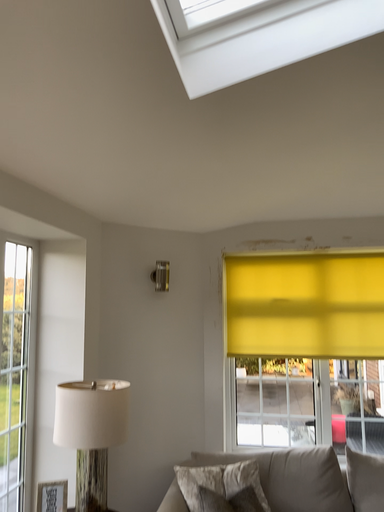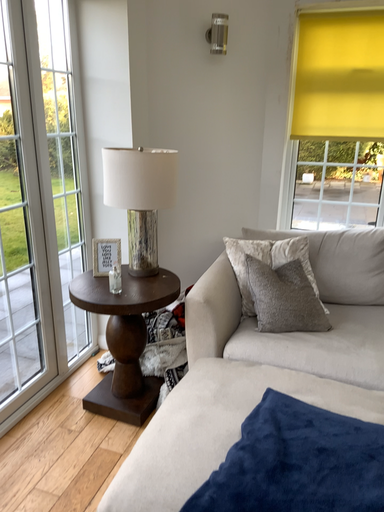
Question: How did the camera likely rotate when shooting the video?

Choices:
 (A) rotated right
 (B) rotated left

Answer: (B)